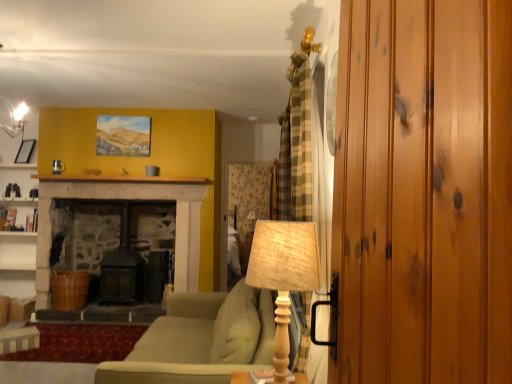
Describe the element at coordinates (252, 219) in the screenshot. I see `burlap lampshade at center, placed as the 1th table lamp when sorted from back to front` at that location.

Describe the element at coordinates (190, 344) in the screenshot. The image size is (512, 384). I see `matte green fabric couch at center` at that location.

Describe the element at coordinates (424, 192) in the screenshot. The image size is (512, 384). I see `glossy wood wardrobe at right` at that location.

This screenshot has width=512, height=384. Find the location of `burlap lampshade at center, placed as the 1th table lamp when sorted from back to front`. burlap lampshade at center, placed as the 1th table lamp when sorted from back to front is located at coordinates (252, 219).

Are glossy wood wardrobe at right and matte green fabric couch at center beside each other?

No, glossy wood wardrobe at right is not beside matte green fabric couch at center.

Which of these two, glossy wood wardrobe at right or matte green fabric couch at center, is wider?

matte green fabric couch at center is wider.

Considering the positions of objects glossy wood wardrobe at right and matte green fabric couch at center in the image provided, who is more to the left, glossy wood wardrobe at right or matte green fabric couch at center?

matte green fabric couch at center.

Which point is more forward, (358, 146) or (143, 357)?

The point (358, 146) is in front.

This screenshot has width=512, height=384. Identify the location of picture frame on the left of the matte green fabric couch at center. (25, 151).

How far apart are matte green fabric couch at center and matte black picture frame at upper left?

matte green fabric couch at center and matte black picture frame at upper left are 3.48 meters apart.

Does matte green fabric couch at center have a smaller size compared to matte black picture frame at upper left?

No, matte green fabric couch at center is not smaller than matte black picture frame at upper left.

Is matte green fabric couch at center directly adjacent to matte black picture frame at upper left?

No, matte green fabric couch at center is not touching matte black picture frame at upper left.

From a real-world perspective, who is located lower, wooden textured table lamp at center, the 2th table lamp viewed from the back, or matte stone fireplace at upper center?

From a 3D spatial view, wooden textured table lamp at center, the 2th table lamp viewed from the back, is below.

Is the position of wooden textured table lamp at center, the 2th table lamp viewed from the back, less distant than that of matte stone fireplace at upper center?

Yes, it is in front of matte stone fireplace at upper center.

In the scene shown: Is wooden textured table lamp at center, the first table lamp when ordered from front to back, not close to matte stone fireplace at upper center?

Indeed, wooden textured table lamp at center, the first table lamp when ordered from front to back, is not near matte stone fireplace at upper center.

In the scene shown: How distant is glossy wood wardrobe at right from matte black picture frame at upper left?

glossy wood wardrobe at right is 5.43 meters away from matte black picture frame at upper left.

Is glossy wood wardrobe at right positioned in front of matte black picture frame at upper left?

Yes, glossy wood wardrobe at right is in front of matte black picture frame at upper left.

How many degrees apart are the facing directions of glossy wood wardrobe at right and matte black picture frame at upper left?

glossy wood wardrobe at right and matte black picture frame at upper left are facing 57.5 degrees away from each other.

From a real-world perspective, is glossy wood wardrobe at right physically located above or below matte black picture frame at upper left?

Clearly, from a real-world perspective, glossy wood wardrobe at right is below matte black picture frame at upper left.

Which of these two, glossy wood wardrobe at right or wooden textured table lamp at center, the 2th table lamp viewed from the back, is smaller?

With smaller size is wooden textured table lamp at center, the 2th table lamp viewed from the back.

Does glossy wood wardrobe at right come in front of wooden textured table lamp at center, the first table lamp when ordered from front to back?

Yes, it is.

Where is `the 1st table lamp behind when counting from the glossy wood wardrobe at right`? The height and width of the screenshot is (384, 512). the 1st table lamp behind when counting from the glossy wood wardrobe at right is located at coordinates (283, 275).

Is glossy wood wardrobe at right facing towards matte stone fireplace at upper center?

No, glossy wood wardrobe at right is not facing towards matte stone fireplace at upper center.

From a real-world perspective, is glossy wood wardrobe at right below matte stone fireplace at upper center?

Yes, from a real-world perspective, glossy wood wardrobe at right is below matte stone fireplace at upper center.

From the image's perspective, does glossy wood wardrobe at right appear higher than matte stone fireplace at upper center?

No, from the image's perspective, glossy wood wardrobe at right is not on top of matte stone fireplace at upper center.

Is the depth of glossy wood wardrobe at right less than that of matte stone fireplace at upper center?

That is True.

Which of these two, wooden textured table lamp at center, the first table lamp when ordered from front to back, or matte black picture frame at upper left, stands taller?

wooden textured table lamp at center, the first table lamp when ordered from front to back, is taller.

From the image's perspective, which one is positioned lower, wooden textured table lamp at center, the first table lamp when ordered from front to back, or matte black picture frame at upper left?

wooden textured table lamp at center, the first table lamp when ordered from front to back, is shown below in the image.

Which table lamp is the 2nd one when counting from the right side of the matte black picture frame at upper left? Please provide its 2D coordinates.

[(283, 275)]

The height and width of the screenshot is (384, 512). Find the location of `studio couch on the left of glossy wood wardrobe at right`. studio couch on the left of glossy wood wardrobe at right is located at coordinates (190, 344).

The width and height of the screenshot is (512, 384). Find the location of `studio couch below the matte black picture frame at upper left (from a real-world perspective)`. studio couch below the matte black picture frame at upper left (from a real-world perspective) is located at coordinates (190, 344).

Looking at the image, which one is located further to matte stone fireplace at upper center, wooden textured table lamp at center, the first table lamp when ordered from front to back, or glossy wood wardrobe at right?

glossy wood wardrobe at right lies further to matte stone fireplace at upper center than the other object.

Looking at the image, which one is located further to matte black picture frame at upper left, glossy wood wardrobe at right or matte green fabric couch at center?

The object further to matte black picture frame at upper left is glossy wood wardrobe at right.

When comparing their distances from matte stone fireplace at upper center, does wooden textured table lamp at center, the 2th table lamp viewed from the back, or matte black picture frame at upper left seem further?

wooden textured table lamp at center, the 2th table lamp viewed from the back.

Considering their positions, is wooden textured table lamp at center, the 2th table lamp viewed from the back, positioned closer to matte green fabric couch at center than matte stone fireplace at upper center?

wooden textured table lamp at center, the 2th table lamp viewed from the back, is positioned closer to the anchor matte green fabric couch at center.

Looking at this image, based on their spatial positions, is matte black picture frame at upper left or glossy wood wardrobe at right closer to burlap lampshade at center, placed as the second table lamp when sorted from front to back?

matte black picture frame at upper left is closer to burlap lampshade at center, placed as the second table lamp when sorted from front to back.

From the image, which object appears to be farther from wooden textured table lamp at center, the 2th table lamp viewed from the back, burlap lampshade at center, placed as the 1th table lamp when sorted from back to front, or matte stone fireplace at upper center?

matte stone fireplace at upper center.

Estimate the real-world distances between objects in this image. Which object is further from matte stone fireplace at upper center, matte black picture frame at upper left or glossy wood wardrobe at right?

Based on the image, glossy wood wardrobe at right appears to be further to matte stone fireplace at upper center.

From the picture: Which object lies nearer to the anchor point burlap lampshade at center, placed as the second table lamp when sorted from front to back, wooden textured table lamp at center, the 2th table lamp viewed from the back, or matte black picture frame at upper left?

matte black picture frame at upper left lies closer to burlap lampshade at center, placed as the second table lamp when sorted from front to back, than the other object.

Where is `studio couch between glossy wood wardrobe at right and matte black picture frame at upper left in the front-back direction`? studio couch between glossy wood wardrobe at right and matte black picture frame at upper left in the front-back direction is located at coordinates (190, 344).

Where is `table lamp between glossy wood wardrobe at right and matte green fabric couch at center from front to back`? Image resolution: width=512 pixels, height=384 pixels. table lamp between glossy wood wardrobe at right and matte green fabric couch at center from front to back is located at coordinates (283, 275).

At what (x,y) coordinates should I click in order to perform the action: click on mantle located between wooden textured table lamp at center, the first table lamp when ordered from front to back, and matte black picture frame at upper left in the depth direction. Please return your answer as a coordinate pair (x, y). Looking at the image, I should click on (121, 179).

Where is `mantle located between glossy wood wardrobe at right and matte black picture frame at upper left in the depth direction`? This screenshot has height=384, width=512. mantle located between glossy wood wardrobe at right and matte black picture frame at upper left in the depth direction is located at coordinates pos(121,179).